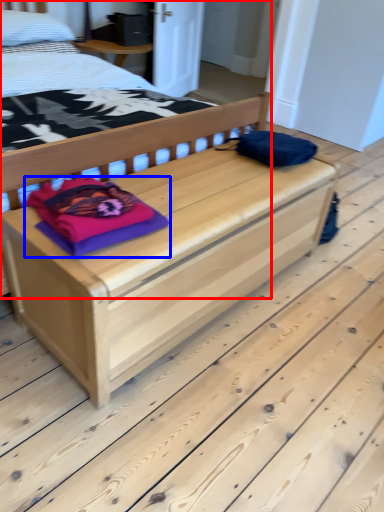
Question: Among these objects, which one is nearest to the camera, bed (highlighted by a red box) or material (highlighted by a blue box)?

Choices:
 (A) bed
 (B) material

Answer: (A)